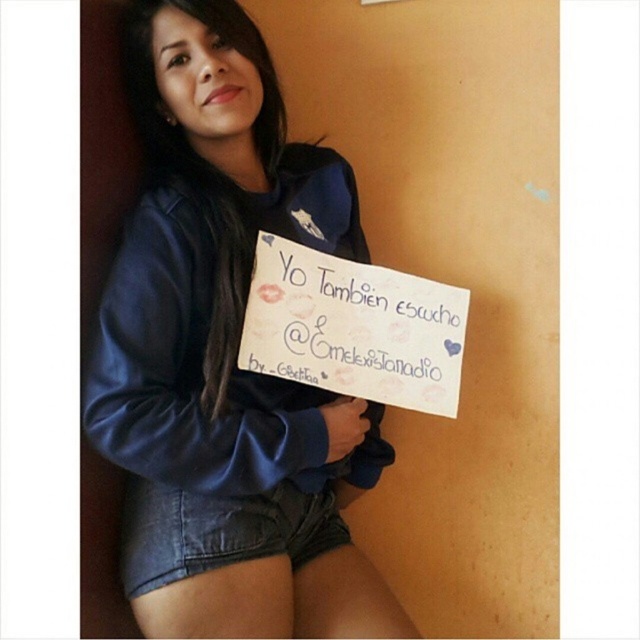
Between blue fleece sweatshirt at upper left and denim shorts at lower center, which one has less height?

With less height is denim shorts at lower center.

Which is more to the left, blue fleece sweatshirt at upper left or denim shorts at lower center?

From the viewer's perspective, denim shorts at lower center appears more on the left side.

Which is behind, point (170, 221) or point (273, 513)?

Point (273, 513)

At what (x,y) coordinates should I click in order to perform the action: click on blue fleece sweatshirt at upper left. Please return your answer as a coordinate pair (x, y). This screenshot has width=640, height=640. Looking at the image, I should click on (227, 356).

Can you confirm if blue fleece sweatshirt at upper left is shorter than white paper at center?

No, blue fleece sweatshirt at upper left is not shorter than white paper at center.

Who is positioned more to the left, blue fleece sweatshirt at upper left or white paper at center?

From the viewer's perspective, blue fleece sweatshirt at upper left appears more on the left side.

Measure the distance between blue fleece sweatshirt at upper left and camera.

blue fleece sweatshirt at upper left and camera are 3.76 feet apart.

This screenshot has height=640, width=640. I want to click on blue fleece sweatshirt at upper left, so click(227, 356).

Is white paper at center to the right of denim shorts at lower center from the viewer's perspective?

Yes, white paper at center is to the right of denim shorts at lower center.

Identify the location of white paper at center. (353, 326).

Describe the element at coordinates (353, 326) in the screenshot. The height and width of the screenshot is (640, 640). I see `white paper at center` at that location.

The height and width of the screenshot is (640, 640). What are the coordinates of `white paper at center` in the screenshot? It's located at (353, 326).